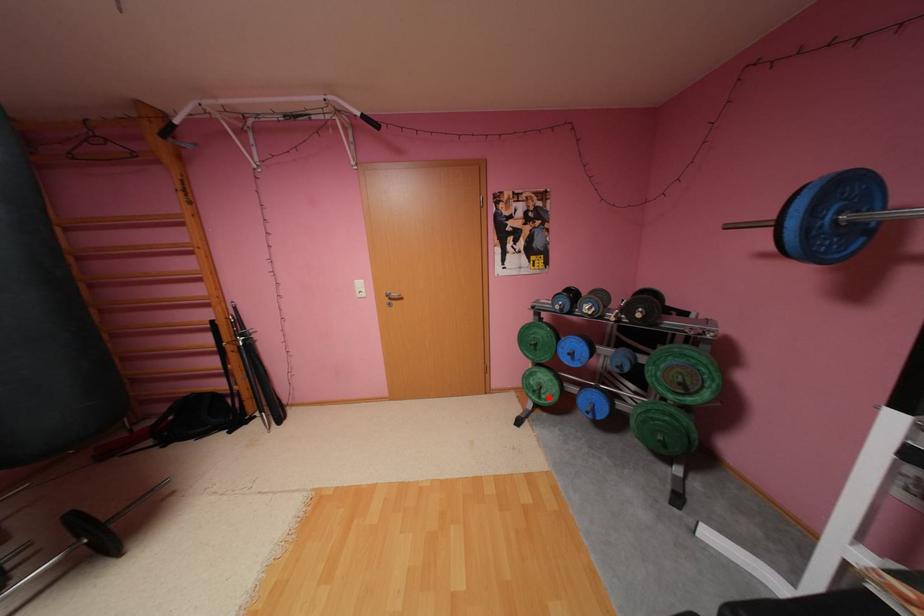
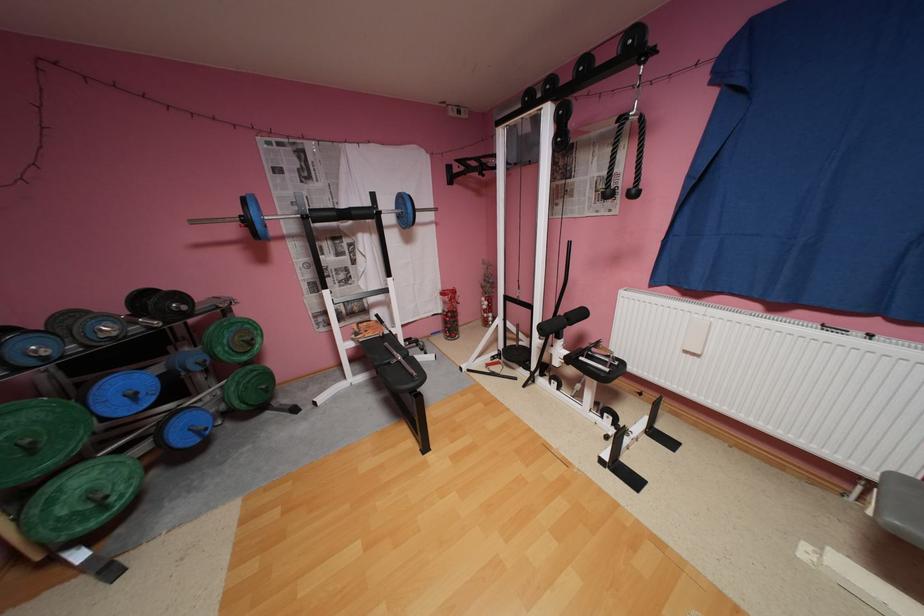
Locate, in the second image, the point that corresponds to the highlighted location in the first image.

(116, 508)